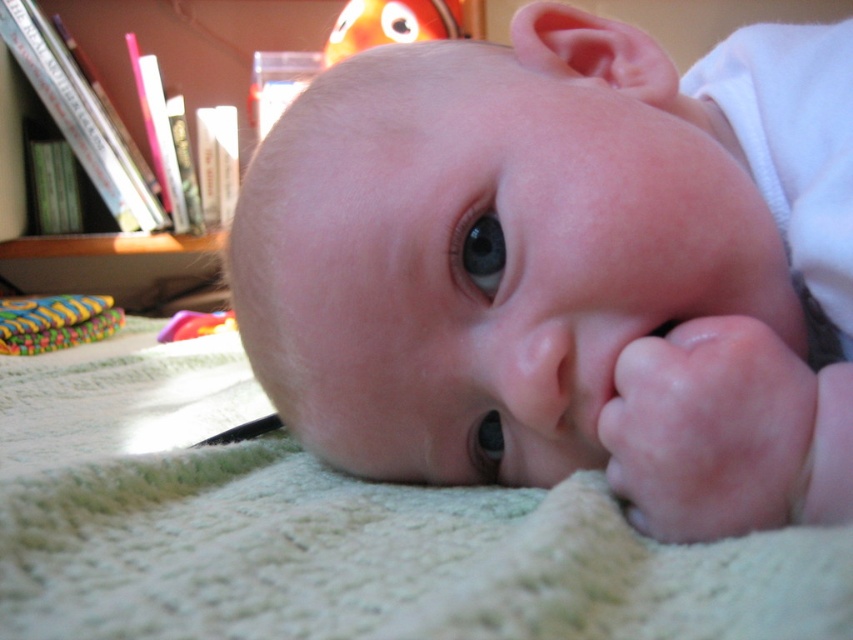
Question: Is wooden bookshelf at left wider than orange plush toy at upper center?

Choices:
 (A) no
 (B) yes

Answer: (B)

Question: Which object is positioned closest to the pink flesh at lower right?

Choices:
 (A) multicolored fabric toy at lower left
 (B) white knitted blanket at center

Answer: (B)

Question: Can you confirm if pink flesh at lower right is smaller than rubberized plastic toy at lower left?

Choices:
 (A) no
 (B) yes

Answer: (B)

Question: Which point appears closest to the camera in this image?

Choices:
 (A) (682, 412)
 (B) (368, 44)
 (C) (45, 320)

Answer: (A)

Question: Which of the following is the farthest from the observer?

Choices:
 (A) (141, 22)
 (B) (654, 326)

Answer: (A)

Question: Is white knitted blanket at center thinner than rubberized plastic toy at lower left?

Choices:
 (A) yes
 (B) no

Answer: (B)